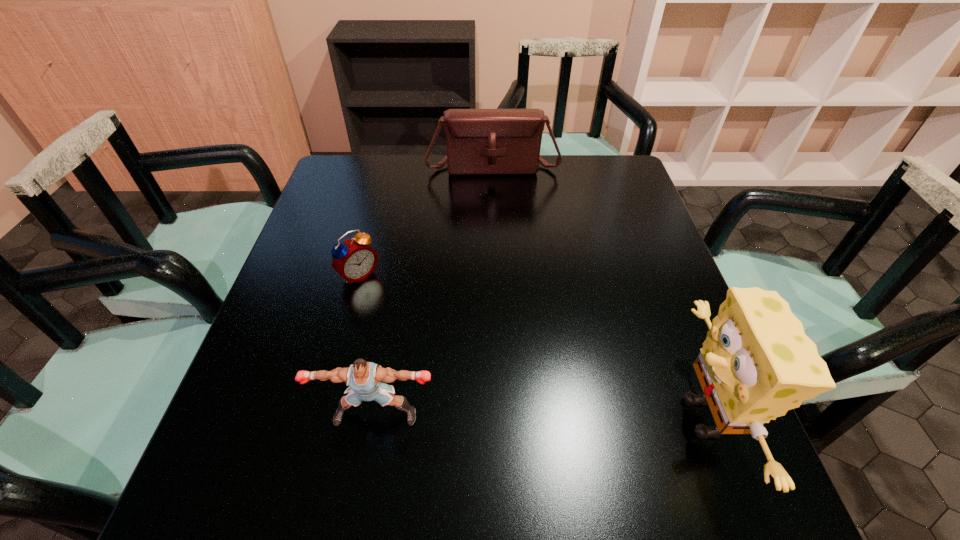
At what (x,y) coordinates should I click in order to perform the action: click on vacant space on the desktop that is between the puncher and the rightmost object and is positioned on the front-facing side of the shortest object. Please return your answer as a coordinate pair (x, y). The image size is (960, 540). Looking at the image, I should click on (497, 415).

You are a GUI agent. You are given a task and a screenshot of the screen. Output one action in this format:
    pyautogui.click(x=<x>, y=<y>)
    Task: Click on the free space on the desktop that is between the second shortest object and the sponge and is positioned on the front flap of the farthest object
    This screenshot has height=540, width=960.
    Given the screenshot: What is the action you would take?
    pyautogui.click(x=520, y=415)